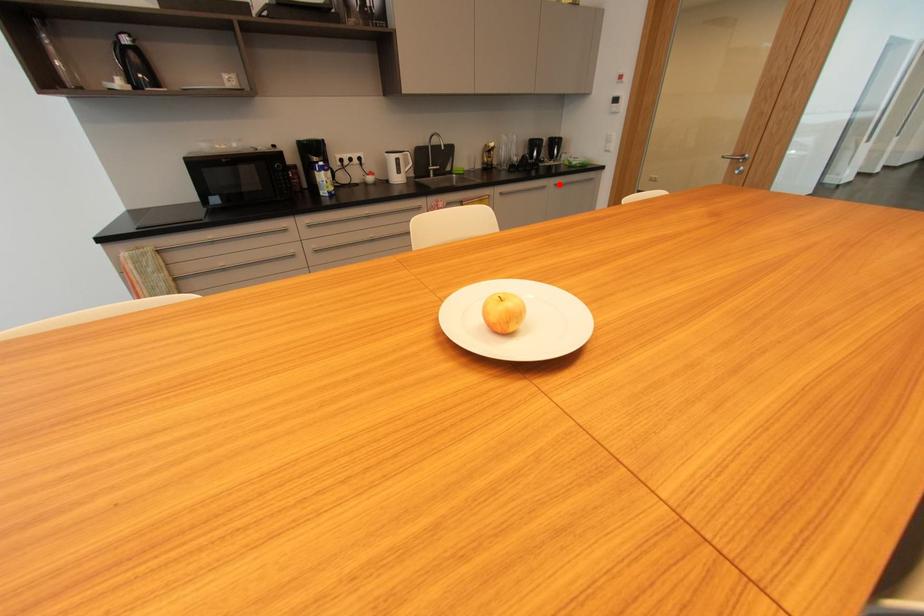
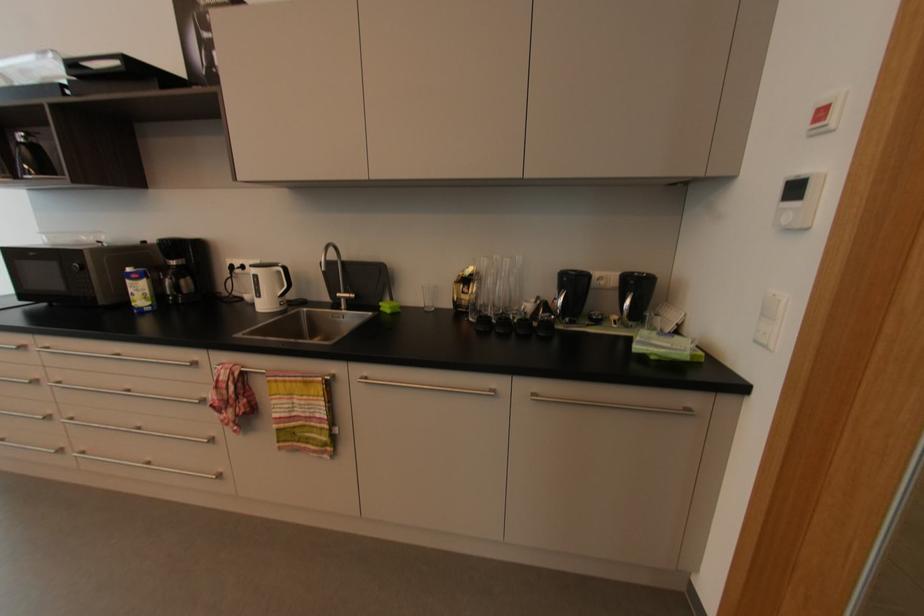
In the second image, find the point that corresponds to the highlighted location in the first image.

(537, 395)